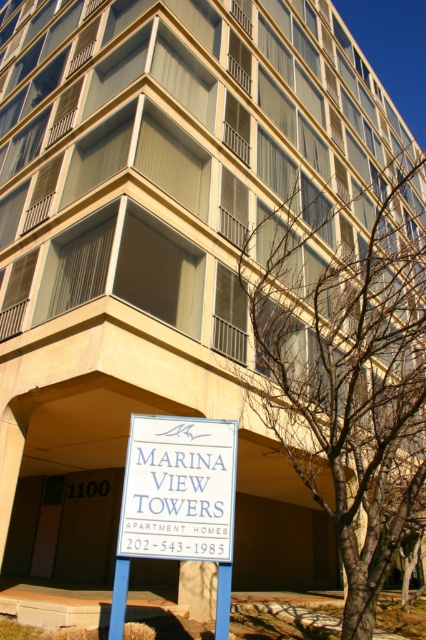
Is bare branches at center thinner than white plastic sign at lower center?

Incorrect, bare branches at center's width is not less than white plastic sign at lower center's.

Can you confirm if bare branches at center is smaller than white plastic sign at lower center?

Actually, bare branches at center might be larger than white plastic sign at lower center.

Is point (405, 337) farther from viewer compared to point (227, 428)?

Yes.

Where is `bare branches at center`? The height and width of the screenshot is (640, 426). bare branches at center is located at coordinates (348, 380).